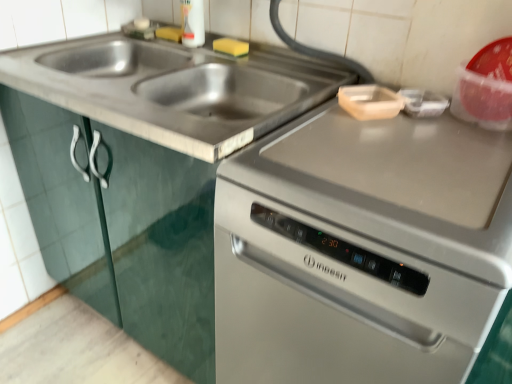
Question: Would you say wooden cutting board at upper right is inside or outside satin silver oven at right?

Choices:
 (A) outside
 (B) inside

Answer: (A)

Question: Visually, is wooden cutting board at upper right positioned to the left or to the right of satin silver oven at right?

Choices:
 (A) left
 (B) right

Answer: (A)

Question: Based on their relative distances, which object is nearer to the yellow sponge at upper center?

Choices:
 (A) stainless steel sink at upper left
 (B) stainless steel dishwasher at center
 (C) satin silver oven at right
 (D) wooden cutting board at upper right

Answer: (A)

Question: Estimate the real-world distances between objects in this image. Which object is farther from the yellow sponge at upper center?

Choices:
 (A) stainless steel dishwasher at center
 (B) satin silver oven at right
 (C) wooden cutting board at upper right
 (D) stainless steel sink at upper left

Answer: (B)